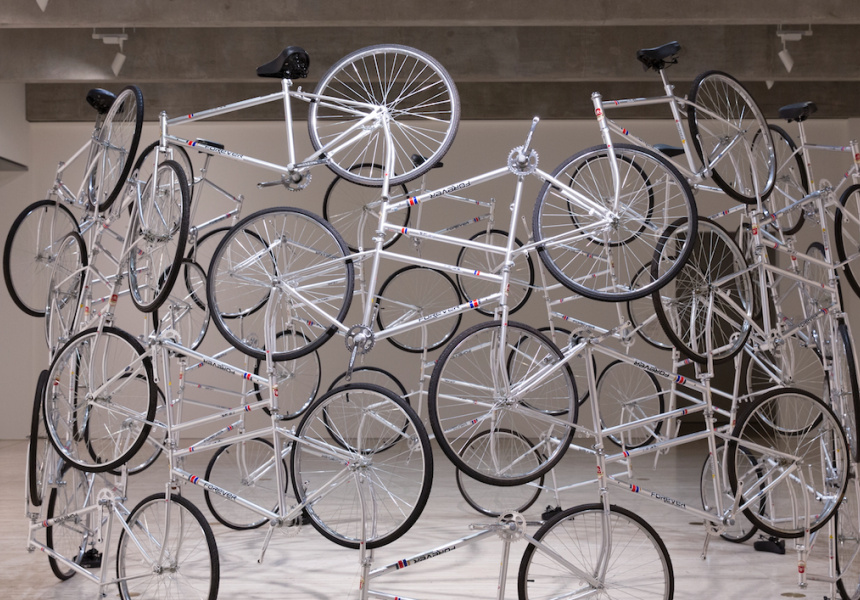
Where is `ceiling beams`? Image resolution: width=860 pixels, height=600 pixels. ceiling beams is located at coordinates (536, 19), (523, 61), (514, 108).